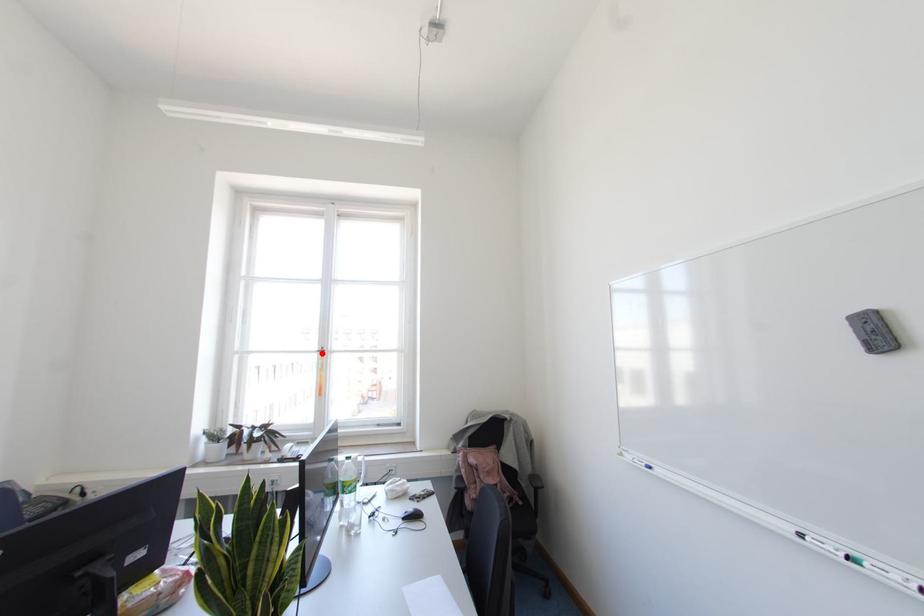
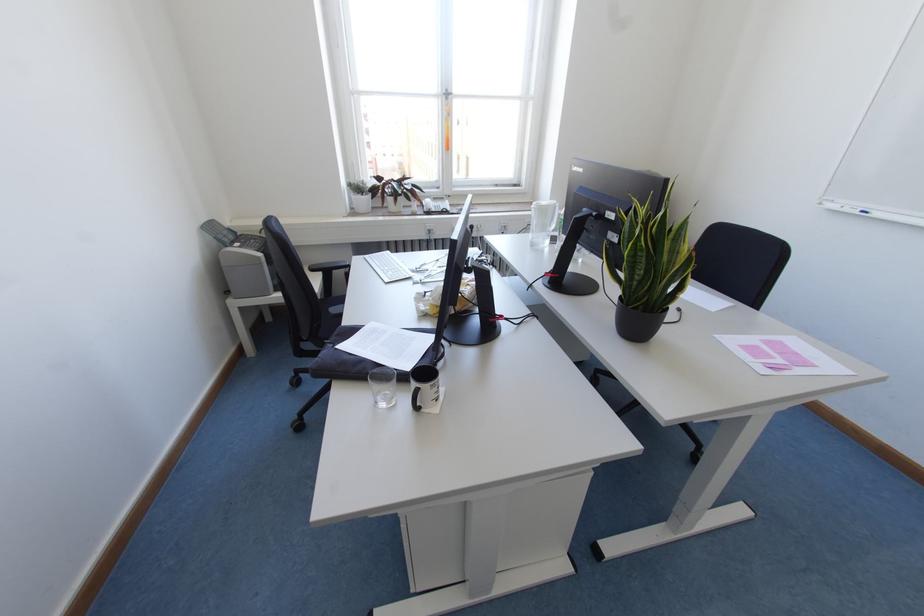
Question: I am providing you with two images of the same scene from different viewpoints. In image1, a red point is highlighted. Considering the same 3D point in image2, which of the following is correct?

Choices:
 (A) It is closer
 (B) It is farther

Answer: (A)